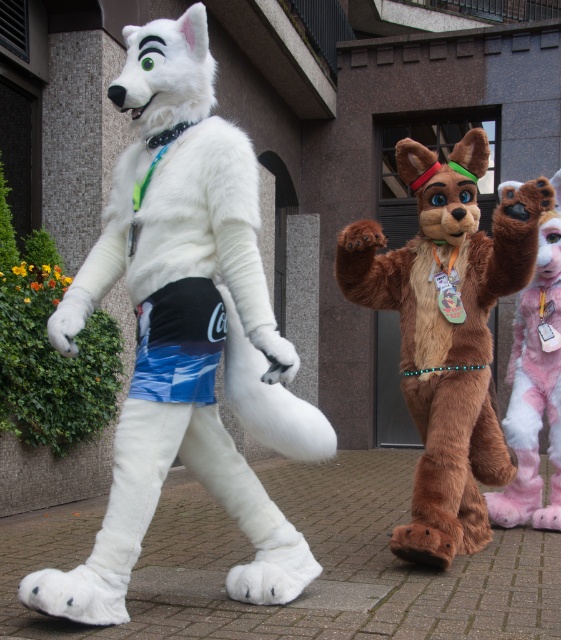
Question: Which point is closer to the camera?

Choices:
 (A) white fur mascot at left
 (B) brown furry dog at center
 (C) fuzzy brown fur at right

Answer: (A)

Question: Does brown furry dog at center have a smaller size compared to fuzzy brown fur at right?

Choices:
 (A) no
 (B) yes

Answer: (A)

Question: Which of the following is the closest to the observer?

Choices:
 (A) (375, 280)
 (B) (96, 552)

Answer: (B)

Question: Which point appears closest to the camera in this image?

Choices:
 (A) (114, 564)
 (B) (518, 509)

Answer: (A)

Question: Considering the relative positions of brown furry dog at center and fuzzy brown fur at right in the image provided, where is brown furry dog at center located with respect to fuzzy brown fur at right?

Choices:
 (A) right
 (B) left

Answer: (B)

Question: Is white fur mascot at left closer to camera compared to brown furry dog at center?

Choices:
 (A) yes
 (B) no

Answer: (A)